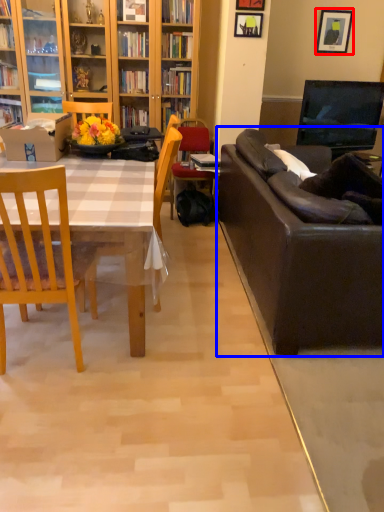
Question: Which object appears farthest to the camera in this image, picture frame (highlighted by a red box) or studio couch (highlighted by a blue box)?

Choices:
 (A) picture frame
 (B) studio couch

Answer: (A)